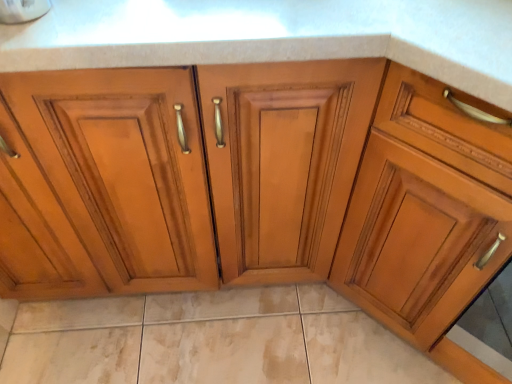
Question: Is beige marble tile at lower center positioned beyond the bounds of matte wood cabinet at right?

Choices:
 (A) no
 (B) yes

Answer: (B)

Question: Does beige marble tile at lower center have a smaller size compared to matte wood cabinet at right?

Choices:
 (A) no
 (B) yes

Answer: (B)

Question: Would you say matte wood cabinet at right is part of beige marble tile at lower center's contents?

Choices:
 (A) no
 (B) yes

Answer: (A)

Question: Does beige marble tile at lower center have a lesser width compared to matte wood cabinet at right?

Choices:
 (A) no
 (B) yes

Answer: (B)

Question: Considering the relative sizes of beige marble tile at lower center and matte wood cabinet at right in the image provided, is beige marble tile at lower center wider than matte wood cabinet at right?

Choices:
 (A) no
 (B) yes

Answer: (A)

Question: Is beige marble tile at lower center oriented away from matte wood cabinet at right?

Choices:
 (A) no
 (B) yes

Answer: (A)

Question: Is matte wood cabinet at right next to beige marble tile at lower center?

Choices:
 (A) yes
 (B) no

Answer: (B)

Question: From the image's perspective, is matte wood cabinet at right on top of beige marble tile at lower center?

Choices:
 (A) yes
 (B) no

Answer: (A)

Question: Is the position of matte wood cabinet at right more distant than that of beige marble tile at lower center?

Choices:
 (A) no
 (B) yes

Answer: (A)

Question: Does matte wood cabinet at right have a lesser height compared to beige marble tile at lower center?

Choices:
 (A) yes
 (B) no

Answer: (B)

Question: Is matte wood cabinet at right thinner than beige marble tile at lower center?

Choices:
 (A) yes
 (B) no

Answer: (B)

Question: Is matte wood cabinet at right located outside beige marble tile at lower center?

Choices:
 (A) no
 (B) yes

Answer: (B)

Question: Does point (122, 321) appear closer or farther from the camera than point (468, 119)?

Choices:
 (A) farther
 (B) closer

Answer: (A)